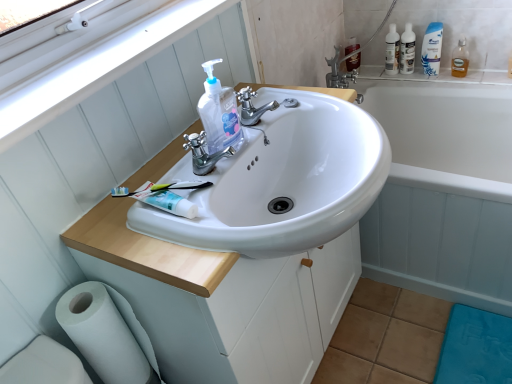
Question: From a real-world perspective, is white plastic window frame at upper left positioned over matte brown spray bottle at upper right, the first cleaning product positioned from the back, based on gravity?

Choices:
 (A) no
 (B) yes

Answer: (B)

Question: Considering the relative sizes of white plastic window frame at upper left and matte brown spray bottle at upper right, placed as the second cleaning product when sorted from top to bottom, in the image provided, is white plastic window frame at upper left wider than matte brown spray bottle at upper right, placed as the second cleaning product when sorted from top to bottom,?

Choices:
 (A) yes
 (B) no

Answer: (A)

Question: Are white plastic window frame at upper left and matte brown spray bottle at upper right, placed as the second cleaning product when sorted from top to bottom, located far from each other?

Choices:
 (A) yes
 (B) no

Answer: (A)

Question: Is white plastic window frame at upper left positioned beyond the bounds of matte brown spray bottle at upper right, the second cleaning product when ordered from right to left?

Choices:
 (A) yes
 (B) no

Answer: (A)

Question: Considering the relative sizes of white plastic window frame at upper left and matte brown spray bottle at upper right, placed as the second cleaning product when sorted from top to bottom, in the image provided, is white plastic window frame at upper left taller than matte brown spray bottle at upper right, placed as the second cleaning product when sorted from top to bottom,?

Choices:
 (A) no
 (B) yes

Answer: (A)

Question: Can matte brown spray bottle at upper right, marked as the 2th cleaning product in a left-to-right arrangement, be found inside white plastic window frame at upper left?

Choices:
 (A) no
 (B) yes

Answer: (A)

Question: From the image's perspective, does white glossy bathtub at upper right appear lower than white glossy cabinet at center?

Choices:
 (A) yes
 (B) no

Answer: (B)

Question: Can you confirm if white glossy bathtub at upper right is positioned to the right of white glossy cabinet at center?

Choices:
 (A) yes
 (B) no

Answer: (A)

Question: Considering the relative positions of white glossy bathtub at upper right and white glossy cabinet at center in the image provided, is white glossy bathtub at upper right behind white glossy cabinet at center?

Choices:
 (A) no
 (B) yes

Answer: (B)

Question: Does white glossy bathtub at upper right appear on the left side of white glossy cabinet at center?

Choices:
 (A) yes
 (B) no

Answer: (B)

Question: Can you confirm if white glossy bathtub at upper right is bigger than white glossy cabinet at center?

Choices:
 (A) no
 (B) yes

Answer: (B)

Question: Is white glossy bathtub at upper right outside of white glossy cabinet at center?

Choices:
 (A) yes
 (B) no

Answer: (A)

Question: Can you confirm if clear plastic hand soap at center, the 3th cleaning product viewed from the top, is bigger than clear plastic bottle at upper right?

Choices:
 (A) no
 (B) yes

Answer: (B)